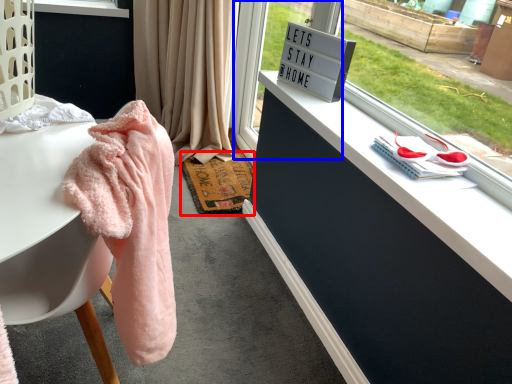
Question: Which object appears closest to the camera in this image, mat (highlighted by a red box) or glass door (highlighted by a blue box)?

Choices:
 (A) mat
 (B) glass door

Answer: (B)